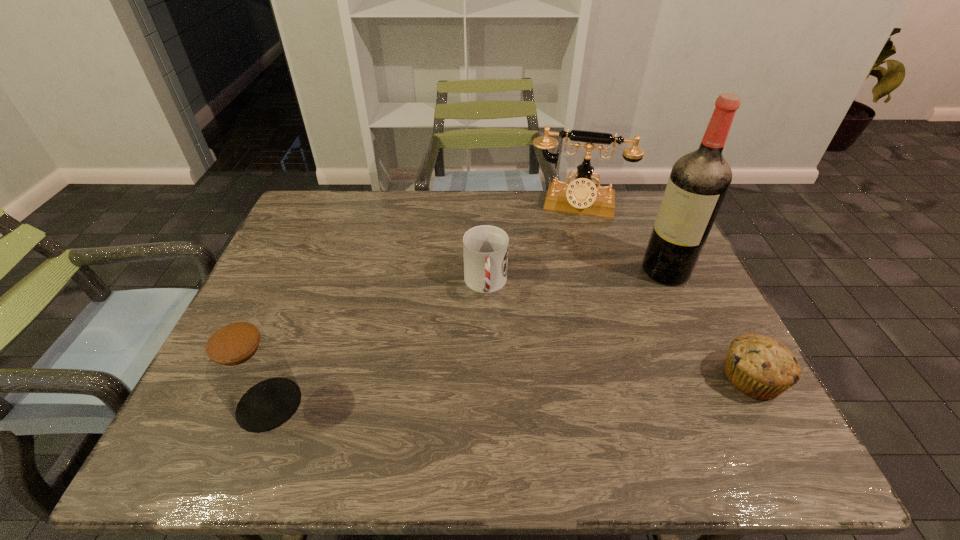
Find the location of a particular element. free space on the desktop that is between the jar and the muffin and is positioned on the front-facing side of the liquor is located at coordinates (450, 394).

At what (x,y) coordinates should I click in order to perform the action: click on free spot on the desktop that is between the leftmost object and the muffin and is positioned on the side of the cup where the handle is located. Please return your answer as a coordinate pair (x, y). Looking at the image, I should click on (493, 392).

You are a GUI agent. You are given a task and a screenshot of the screen. Output one action in this format:
    pyautogui.click(x=<x>, y=<y>)
    Task: Click on the free spot on the desktop that is between the third tallest object and the muffin and is positioned on the dial of the telephone
    
    Given the screenshot: What is the action you would take?
    pyautogui.click(x=552, y=389)